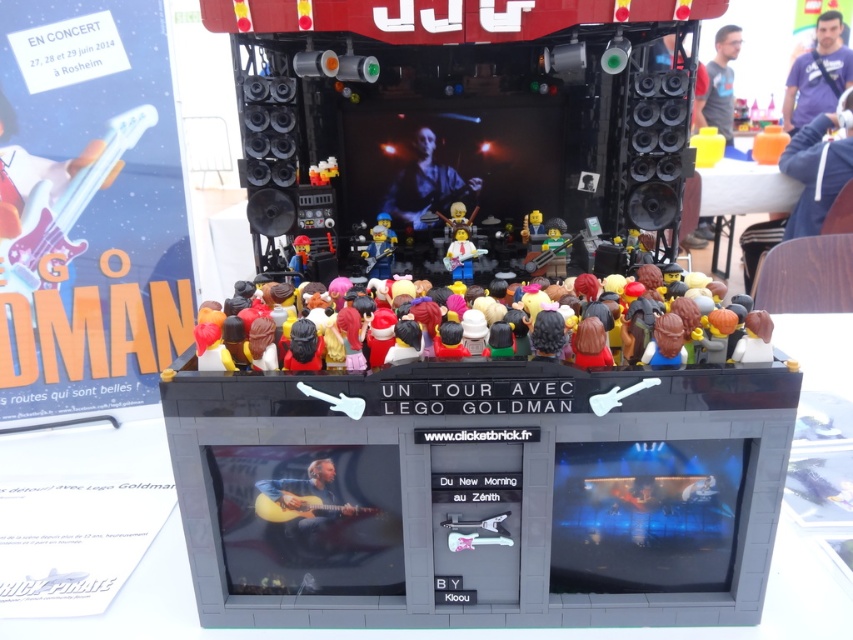
Question: Which point is farther from the camera taking this photo?

Choices:
 (A) (331, 173)
 (B) (695, 332)
 (C) (712, 58)
 (D) (798, 67)

Answer: (D)

Question: Does wooden table at right appear on the right side of blue fabric pants at upper right?

Choices:
 (A) no
 (B) yes

Answer: (A)

Question: Observing the image, what is the correct spatial positioning of wooden acoustic guitar at center in reference to wooden table at right?

Choices:
 (A) left
 (B) right

Answer: (A)

Question: Does wooden table at right lie behind matte black guitar at center?

Choices:
 (A) no
 (B) yes

Answer: (B)

Question: Which object is positioned farthest from the gray fabric shirt at upper right?

Choices:
 (A) matte yellow minifigure at center
 (B) wooden table at right
 (C) multicolored plastic minifigures at center
 (D) blue fabric pants at upper right

Answer: (C)

Question: Among these objects, which one is nearest to the camera?

Choices:
 (A) purple shirt at upper right
 (B) gray fabric shirt at upper right

Answer: (B)